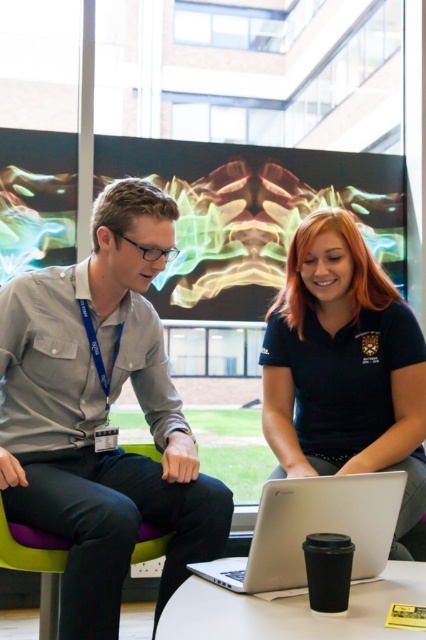
Question: Which point is closer to the camera?

Choices:
 (A) purple fabric chair at lower left
 (B) black matte shirt at center

Answer: (A)

Question: Which object appears closest to the camera in this image?

Choices:
 (A) gray fabric shirt at center
 (B) purple fabric chair at lower left

Answer: (A)

Question: Does gray fabric shirt at center come behind silver metallic laptop at center?

Choices:
 (A) yes
 (B) no

Answer: (A)

Question: Which object appears farthest from the camera in this image?

Choices:
 (A) gray fabric shirt at center
 (B) purple fabric chair at lower left

Answer: (B)

Question: Does gray fabric shirt at center appear under white glossy table at lower center?

Choices:
 (A) no
 (B) yes

Answer: (A)

Question: Is gray fabric shirt at center below white glossy table at lower center?

Choices:
 (A) no
 (B) yes

Answer: (A)